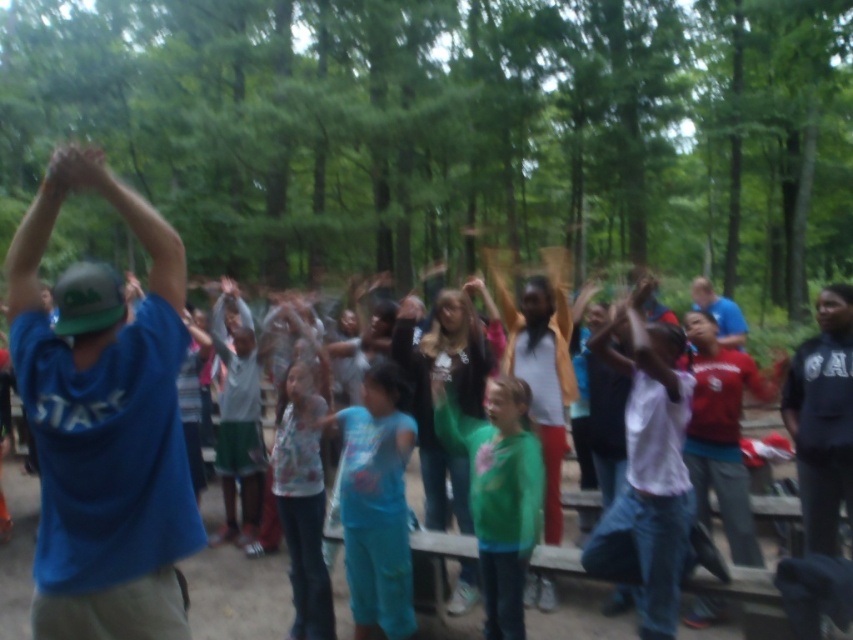
Is green matte hoodie at center above printed cotton shirt at center?

Yes, green matte hoodie at center is above printed cotton shirt at center.

In order to click on green matte hoodie at center in this screenshot , I will do `click(498, 492)`.

The width and height of the screenshot is (853, 640). I want to click on green matte hoodie at center, so click(498, 492).

Can you confirm if blue cotton shirt at center is positioned below green matte hoodie at center?

Correct, blue cotton shirt at center is located below green matte hoodie at center.

Who is more distant from viewer, (355, 515) or (521, 477)?

Positioned behind is point (355, 515).

The width and height of the screenshot is (853, 640). What are the coordinates of `blue cotton shirt at center` in the screenshot? It's located at (376, 504).

Looking at this image, does blue cotton shirt at center lie behind printed cotton shirt at center?

No, blue cotton shirt at center is closer to the viewer.

Does point (389, 483) come behind point (325, 568)?

No, (389, 483) is in front of (325, 568).

This screenshot has height=640, width=853. In order to click on blue cotton shirt at center in this screenshot , I will do `click(376, 504)`.